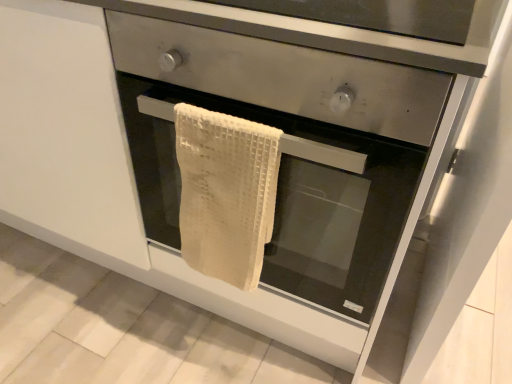
Question: Considering the relative sizes of white woven towel at center and beige woven towel at center in the image provided, is white woven towel at center taller than beige woven towel at center?

Choices:
 (A) yes
 (B) no

Answer: (A)

Question: Is white woven towel at center at the left side of beige woven towel at center?

Choices:
 (A) no
 (B) yes

Answer: (A)

Question: Can you confirm if white woven towel at center is wider than beige woven towel at center?

Choices:
 (A) yes
 (B) no

Answer: (A)

Question: Can you confirm if white woven towel at center is thinner than beige woven towel at center?

Choices:
 (A) yes
 (B) no

Answer: (B)

Question: Is white woven towel at center shorter than beige woven towel at center?

Choices:
 (A) yes
 (B) no

Answer: (B)

Question: Is white woven towel at center located outside beige woven towel at center?

Choices:
 (A) yes
 (B) no

Answer: (A)

Question: Is beige woven towel at center to the left of white woven towel at center from the viewer's perspective?

Choices:
 (A) no
 (B) yes

Answer: (B)

Question: Is beige woven towel at center positioned far away from white woven towel at center?

Choices:
 (A) yes
 (B) no

Answer: (B)

Question: Is beige woven towel at center turned away from white woven towel at center?

Choices:
 (A) yes
 (B) no

Answer: (A)

Question: Is beige woven towel at center facing towards white woven towel at center?

Choices:
 (A) no
 (B) yes

Answer: (B)

Question: Would you say beige woven towel at center is outside white woven towel at center?

Choices:
 (A) no
 (B) yes

Answer: (A)

Question: Can you confirm if beige woven towel at center is bigger than white woven towel at center?

Choices:
 (A) no
 (B) yes

Answer: (A)

Question: Can you confirm if beige woven towel at center is shorter than white waffle towel at center?

Choices:
 (A) no
 (B) yes

Answer: (A)